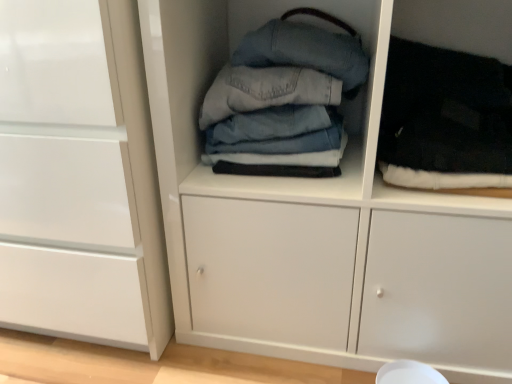
How much space does denim fabric jeans at center, acting as the second clothing starting from the right, occupy horizontally?

It is 10.92 inches.

What do you see at coordinates (79, 177) in the screenshot? I see `white glossy cabinet at left` at bounding box center [79, 177].

You are a GUI agent. You are given a task and a screenshot of the screen. Output one action in this format:
    pyautogui.click(x=<x>, y=<y>)
    Task: Click on the denim fabric stack at center
    The width and height of the screenshot is (512, 384).
    Given the screenshot: What is the action you would take?
    pyautogui.click(x=318, y=224)

Identify the location of black fuzzy socks at right, which is the 2th clothing in left-to-right order. The image size is (512, 384). (445, 119).

Can you confirm if white glossy cabinet at left is thinner than denim fabric stack at center?

No, white glossy cabinet at left is not thinner than denim fabric stack at center.

Is white glossy cabinet at left in front of or behind denim fabric stack at center in the image?

white glossy cabinet at left is positioned farther from the viewer than denim fabric stack at center.

Between white glossy cabinet at left and denim fabric stack at center, which one has smaller size?

denim fabric stack at center is smaller.

Is white glossy cabinet at left turned away from black fuzzy socks at right, which is the 2th clothing in left-to-right order?

No, white glossy cabinet at left's orientation is not away from black fuzzy socks at right, which is the 2th clothing in left-to-right order.

Can you confirm if white glossy cabinet at left is thinner than black fuzzy socks at right, the first clothing in the right-to-left sequence?

No.

Looking at this image, is white glossy cabinet at left spatially inside black fuzzy socks at right, the first clothing in the right-to-left sequence, or outside of it?

white glossy cabinet at left cannot be found inside black fuzzy socks at right, the first clothing in the right-to-left sequence.

From a real-world perspective, is white glossy cabinet at left physically above black fuzzy socks at right, the first clothing in the right-to-left sequence?

No, from a real-world perspective, white glossy cabinet at left is not on top of black fuzzy socks at right, the first clothing in the right-to-left sequence.

Who is smaller, denim fabric stack at center or black fuzzy socks at right, which is the 2th clothing in left-to-right order?

With smaller size is black fuzzy socks at right, which is the 2th clothing in left-to-right order.

From the image's perspective, who appears lower, denim fabric stack at center or black fuzzy socks at right, the first clothing in the right-to-left sequence?

From the image's view, denim fabric stack at center is below.

From a real-world perspective, which object stands above the other?

In real-world perspective, black fuzzy socks at right, the first clothing in the right-to-left sequence, is above.

Is denim fabric stack at center thinner than black fuzzy socks at right, the first clothing in the right-to-left sequence?

No, denim fabric stack at center is not thinner than black fuzzy socks at right, the first clothing in the right-to-left sequence.

Can you see denim fabric stack at center touching denim fabric jeans at center, which ranks as the first clothing in left-to-right order?

There is a gap between denim fabric stack at center and denim fabric jeans at center, which ranks as the first clothing in left-to-right order.

Locate an element on the screen. cupboard below the denim fabric jeans at center, acting as the second clothing starting from the right (from a real-world perspective) is located at coordinates (318, 224).

Looking at this image, which of these two, denim fabric stack at center or denim fabric jeans at center, acting as the second clothing starting from the right, is wider?

denim fabric stack at center.

Considering the points (222, 312) and (257, 148), which point is in front, point (222, 312) or point (257, 148)?

The point (257, 148) is closer to the camera.

Which of these two, black fuzzy socks at right, the first clothing in the right-to-left sequence, or denim fabric jeans at center, acting as the second clothing starting from the right, is wider?

black fuzzy socks at right, the first clothing in the right-to-left sequence.

Based on the photo, from the image's perspective, relative to denim fabric jeans at center, acting as the second clothing starting from the right, is black fuzzy socks at right, the first clothing in the right-to-left sequence, above or below?

Clearly, from the image's perspective, black fuzzy socks at right, the first clothing in the right-to-left sequence, is below denim fabric jeans at center, acting as the second clothing starting from the right.

Considering the relative positions of black fuzzy socks at right, which is the 2th clothing in left-to-right order, and denim fabric jeans at center, acting as the second clothing starting from the right, in the image provided, is black fuzzy socks at right, which is the 2th clothing in left-to-right order, to the right of denim fabric jeans at center, acting as the second clothing starting from the right, from the viewer's perspective?

Correct, you'll find black fuzzy socks at right, which is the 2th clothing in left-to-right order, to the right of denim fabric jeans at center, acting as the second clothing starting from the right.

Which is more to the right, denim fabric stack at center or white glossy cabinet at left?

denim fabric stack at center.

Is denim fabric stack at center not close to white glossy cabinet at left?

No, denim fabric stack at center is not far away from white glossy cabinet at left.

Is white glossy cabinet at left inside denim fabric stack at center?

No, white glossy cabinet at left is not inside denim fabric stack at center.

Who is taller, denim fabric stack at center or white glossy cabinet at left?

denim fabric stack at center is taller.

Is point (310, 62) positioned behind point (394, 83)?

No, (310, 62) is closer to viewer.

Consider the image. Is denim fabric jeans at center, which ranks as the first clothing in left-to-right order, taller or shorter than black fuzzy socks at right, which is the 2th clothing in left-to-right order?

Clearly, denim fabric jeans at center, which ranks as the first clothing in left-to-right order, is taller compared to black fuzzy socks at right, which is the 2th clothing in left-to-right order.

Does denim fabric jeans at center, which ranks as the first clothing in left-to-right order, have a lesser width compared to black fuzzy socks at right, the first clothing in the right-to-left sequence?

Indeed, denim fabric jeans at center, which ranks as the first clothing in left-to-right order, has a lesser width compared to black fuzzy socks at right, the first clothing in the right-to-left sequence.

I want to click on cabinetry that appears above the denim fabric stack at center (from a real-world perspective), so click(x=79, y=177).

You are a GUI agent. You are given a task and a screenshot of the screen. Output one action in this format:
    pyautogui.click(x=<x>, y=<y>)
    Task: Click on the cabinetry below the black fuzzy socks at right, the first clothing in the right-to-left sequence (from the image's perspective)
    The width and height of the screenshot is (512, 384).
    Given the screenshot: What is the action you would take?
    pyautogui.click(x=79, y=177)

Based on the photo, looking at the image, which one is located closer to white glossy cabinet at left, black fuzzy socks at right, the first clothing in the right-to-left sequence, or denim fabric jeans at center, which ranks as the first clothing in left-to-right order?

The object closer to white glossy cabinet at left is denim fabric jeans at center, which ranks as the first clothing in left-to-right order.

In the scene shown: Looking at the image, which one is located further to denim fabric stack at center, white glossy cabinet at left or black fuzzy socks at right, the first clothing in the right-to-left sequence?

Based on the image, white glossy cabinet at left appears to be further to denim fabric stack at center.

Which object lies further to the anchor point white glossy cabinet at left, denim fabric jeans at center, acting as the second clothing starting from the right, or denim fabric stack at center?

denim fabric jeans at center, acting as the second clothing starting from the right, is positioned further to the anchor white glossy cabinet at left.

From the image, which object appears to be nearer to denim fabric stack at center, black fuzzy socks at right, the first clothing in the right-to-left sequence, or white glossy cabinet at left?

black fuzzy socks at right, the first clothing in the right-to-left sequence, lies closer to denim fabric stack at center than the other object.

Which object lies nearer to the anchor point denim fabric jeans at center, which ranks as the first clothing in left-to-right order, denim fabric stack at center or black fuzzy socks at right, which is the 2th clothing in left-to-right order?

denim fabric stack at center is positioned closer to the anchor denim fabric jeans at center, which ranks as the first clothing in left-to-right order.

Considering their positions, is black fuzzy socks at right, the first clothing in the right-to-left sequence, positioned closer to white glossy cabinet at left than denim fabric stack at center?

Based on the image, denim fabric stack at center appears to be nearer to white glossy cabinet at left.

Based on their spatial positions, is white glossy cabinet at left or black fuzzy socks at right, the first clothing in the right-to-left sequence, further from denim fabric jeans at center, which ranks as the first clothing in left-to-right order?

white glossy cabinet at left.

Looking at the image, which one is located further to white glossy cabinet at left, denim fabric stack at center or black fuzzy socks at right, which is the 2th clothing in left-to-right order?

Answer: The object further to white glossy cabinet at left is black fuzzy socks at right, which is the 2th clothing in left-to-right order.

Locate an element on the screen. The image size is (512, 384). cupboard between white glossy cabinet at left and black fuzzy socks at right, the first clothing in the right-to-left sequence, in the horizontal direction is located at coordinates (318, 224).

The image size is (512, 384). What are the coordinates of `clothing between white glossy cabinet at left and denim fabric stack at center from left to right` in the screenshot? It's located at (284, 100).

Where is `clothing between white glossy cabinet at left and black fuzzy socks at right, the first clothing in the right-to-left sequence`? The height and width of the screenshot is (384, 512). clothing between white glossy cabinet at left and black fuzzy socks at right, the first clothing in the right-to-left sequence is located at coordinates (284, 100).

Where is `cupboard situated between denim fabric jeans at center, acting as the second clothing starting from the right, and black fuzzy socks at right, the first clothing in the right-to-left sequence, from left to right`? The height and width of the screenshot is (384, 512). cupboard situated between denim fabric jeans at center, acting as the second clothing starting from the right, and black fuzzy socks at right, the first clothing in the right-to-left sequence, from left to right is located at coordinates (318, 224).